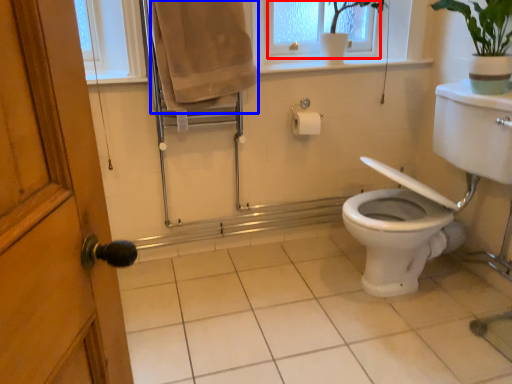
Question: Which point is further to the camera, window frame (highlighted by a red box) or bath towel (highlighted by a blue box)?

Choices:
 (A) window frame
 (B) bath towel

Answer: (A)